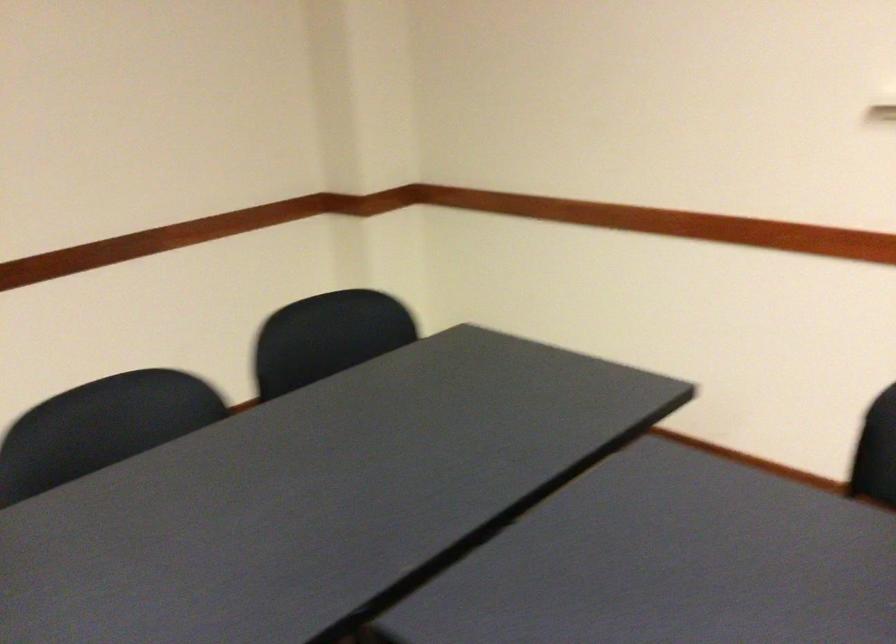
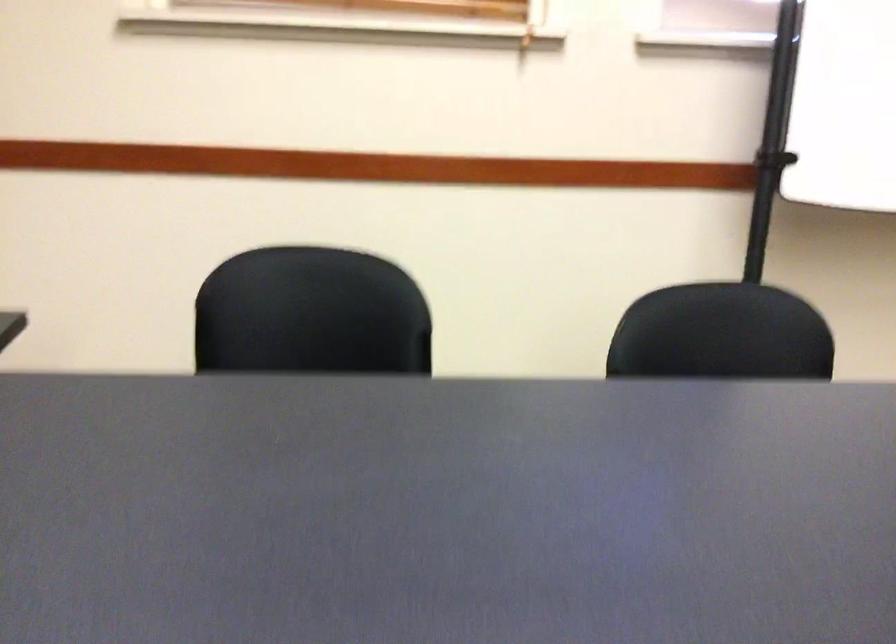
Question: Based on the continuous images, in which direction is the camera rotating? Reply with the corresponding letter.

Choices:
 (A) Left
 (B) Right
 (C) Up
 (D) Down

Answer: (B)